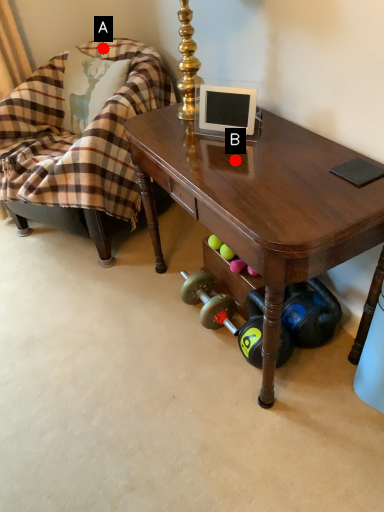
Question: Two points are circled on the image, labeled by A and B beside each circle. Among these points, which one is farthest from the camera?

Choices:
 (A) A is further
 (B) B is further

Answer: (A)